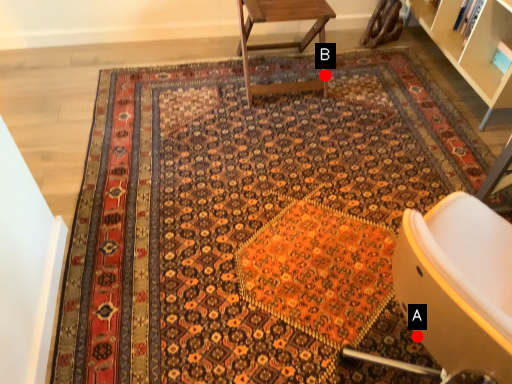
Question: Two points are circled on the image, labeled by A and B beside each circle. Which of the following is the closest to the observer?

Choices:
 (A) A is closer
 (B) B is closer

Answer: (A)